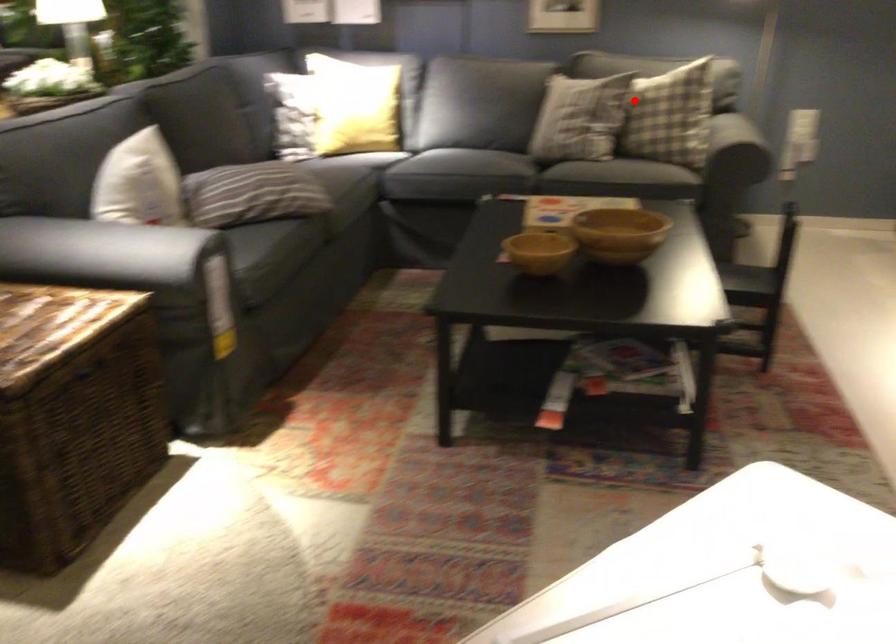
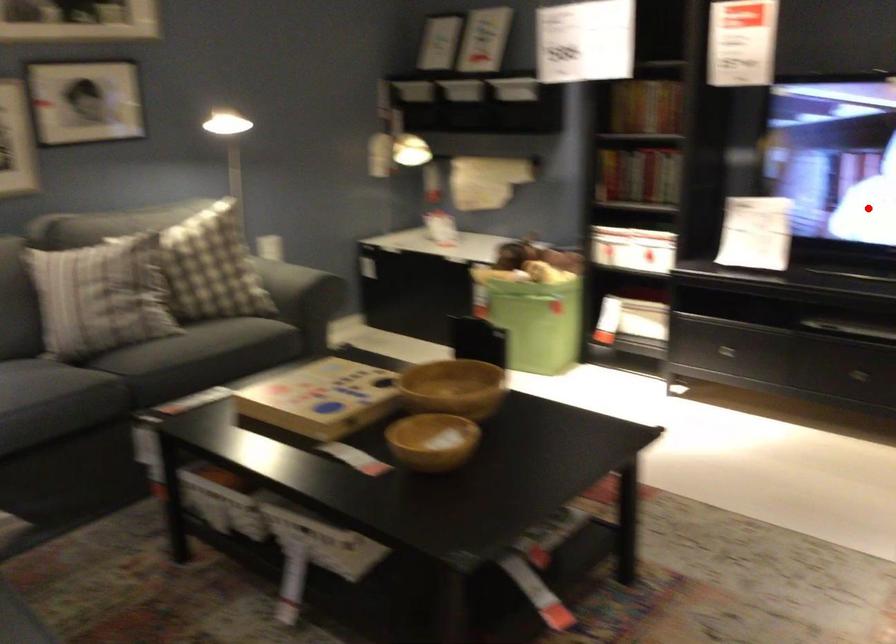
I am providing you with two images of the same scene from different viewpoints. A red point is marked on the first image and another point is marked on the second image. Does the point marked in image1 correspond to the same location as the one in image2?

No